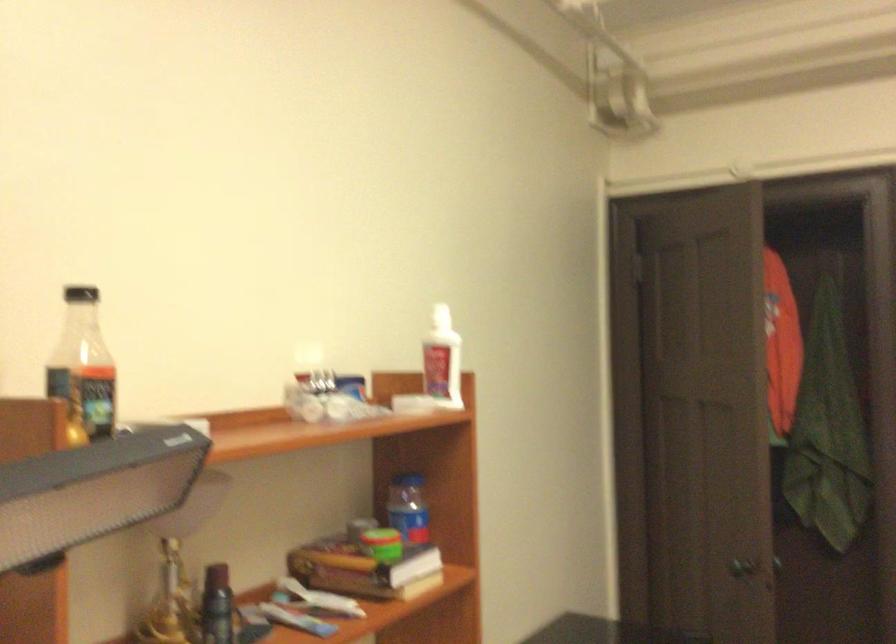
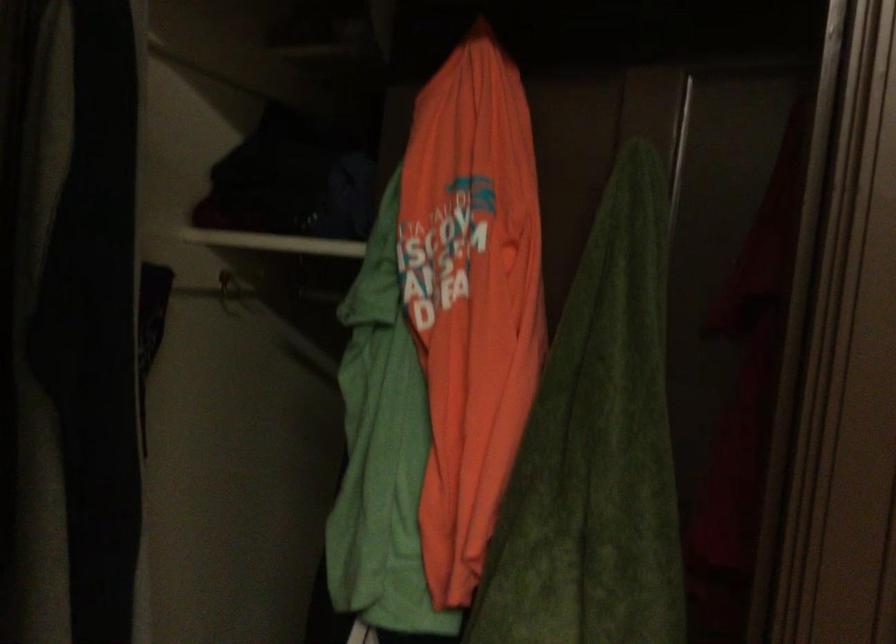
In a continuous first-person perspective shot, in which direction is the camera moving?

The movement direction of the cameraman is right, forward.